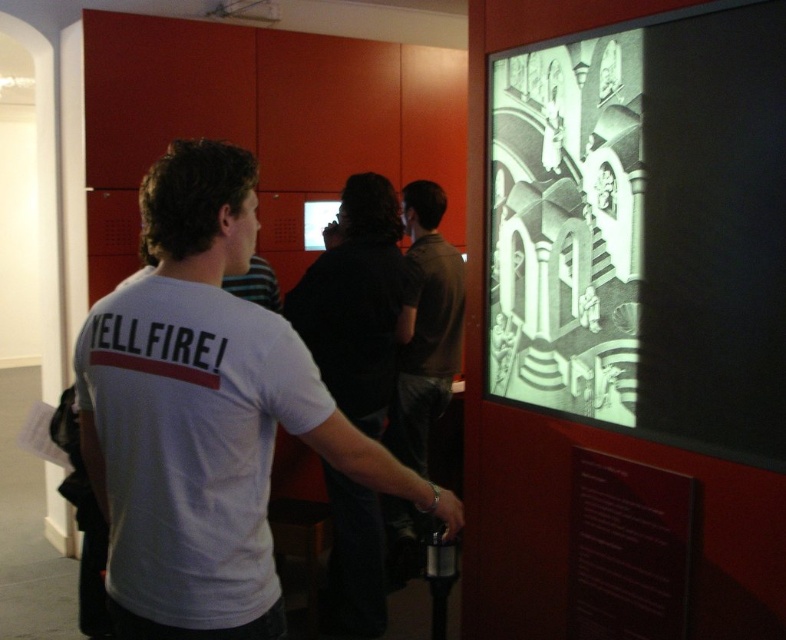
Is monochrome paper artwork at center taller than black matte shirt at center?

No, monochrome paper artwork at center is not taller than black matte shirt at center.

Does point (533, 54) come farther from viewer compared to point (333, 584)?

No, it is in front of (333, 584).

The height and width of the screenshot is (640, 786). Describe the element at coordinates (566, 225) in the screenshot. I see `monochrome paper artwork at center` at that location.

Locate an element on the screen. This screenshot has height=640, width=786. monochrome paper artwork at center is located at coordinates (566, 225).

Who is higher up, monochrome paper artwork at center or dark brown shirt at center?

Positioned higher is monochrome paper artwork at center.

Consider the image. Is monochrome paper artwork at center wider than dark brown shirt at center?

No, monochrome paper artwork at center is not wider than dark brown shirt at center.

Is point (509, 285) closer to camera compared to point (436, 260)?

Yes, point (509, 285) is closer to viewer.

Identify the location of monochrome paper artwork at center. (566, 225).

Which of these two, white t-shirt at center or black matte shirt at center, stands taller?

Standing taller between the two is black matte shirt at center.

Is white t-shirt at center closer to the viewer compared to black matte shirt at center?

Yes, white t-shirt at center is in front of black matte shirt at center.

Who is more distant from viewer, (454, 508) or (380, 608)?

Positioned behind is point (380, 608).

Locate an element on the screen. The image size is (786, 640). white t-shirt at center is located at coordinates (204, 416).